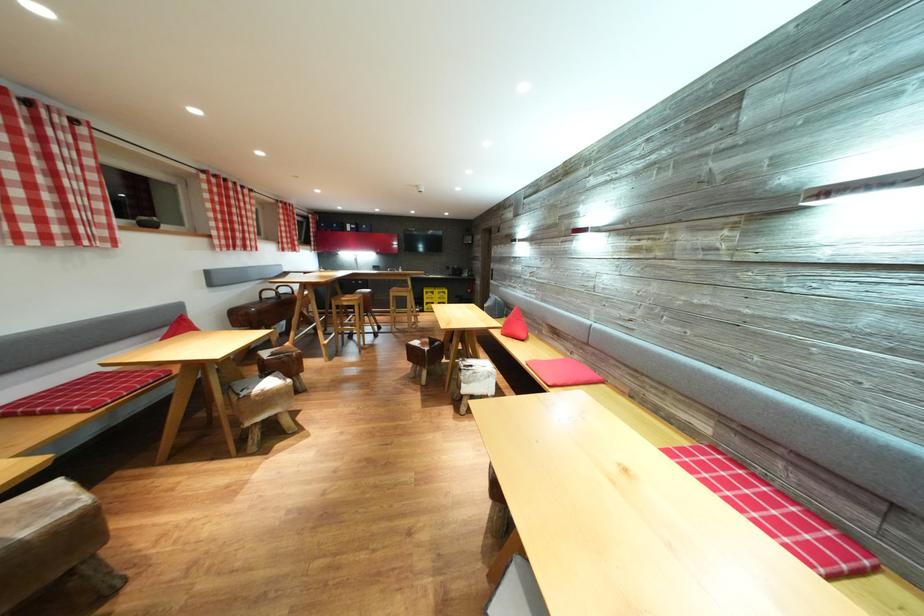
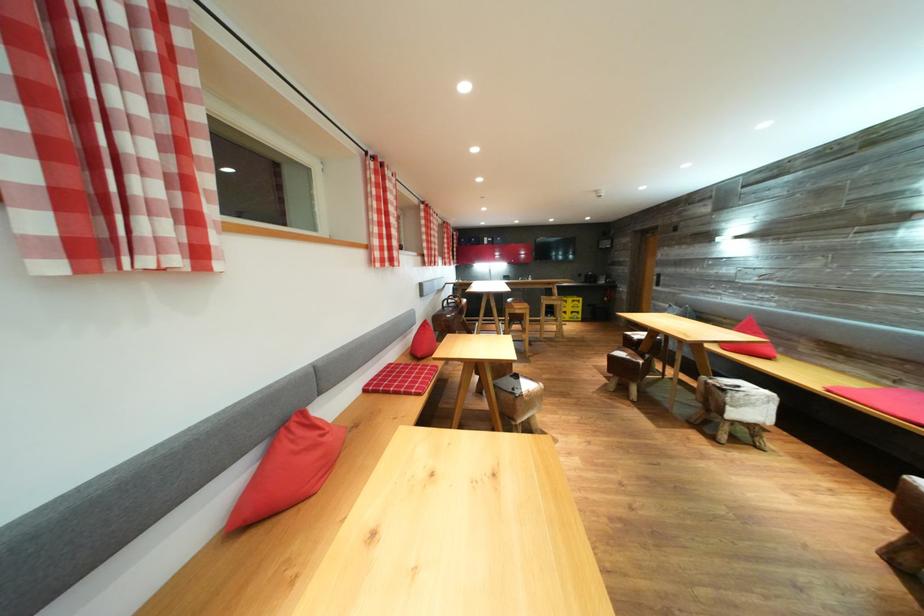
The point at (478, 371) is marked in the first image. Where is the corresponding point in the second image?

(745, 392)